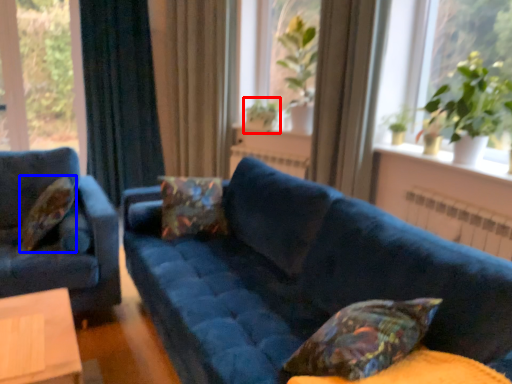
Question: Which of the following is the farthest to the observer, plant (highlighted by a red box) or pillow (highlighted by a blue box)?

Choices:
 (A) plant
 (B) pillow

Answer: (A)